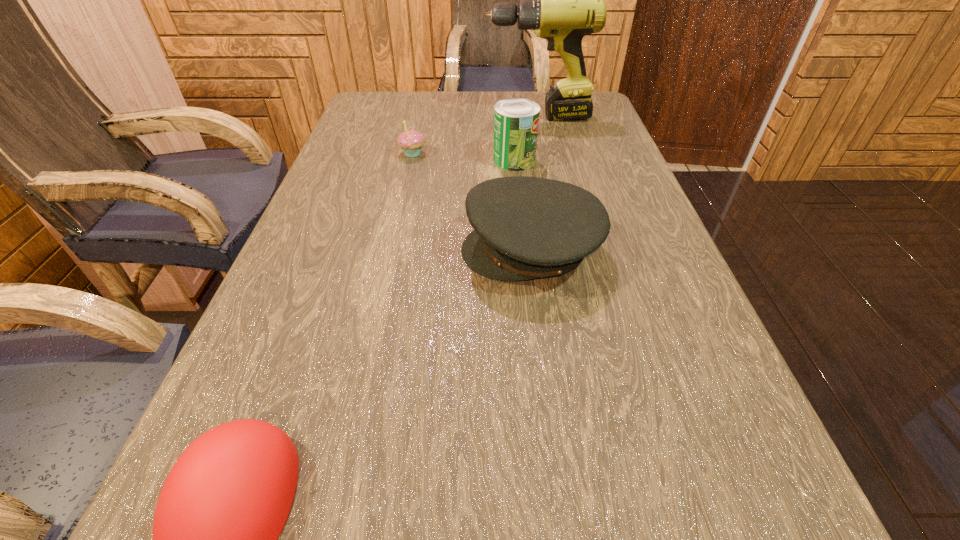
The width and height of the screenshot is (960, 540). In order to click on vacant space situated on the front-facing side of the beret in this screenshot , I will do `click(350, 250)`.

The height and width of the screenshot is (540, 960). Find the location of `free region located 0.240m on the front-facing side of the beret`. free region located 0.240m on the front-facing side of the beret is located at coordinates (340, 250).

Locate an element on the screen. Image resolution: width=960 pixels, height=540 pixels. vacant area located 0.180m on the right of the cupcake is located at coordinates (495, 154).

This screenshot has height=540, width=960. In order to click on object at the far edge in this screenshot , I will do `click(561, 0)`.

Image resolution: width=960 pixels, height=540 pixels. I want to click on drill present at the right edge, so [561, 0].

The image size is (960, 540). What are the coordinates of `beret that is at the right edge` in the screenshot? It's located at (x=525, y=228).

This screenshot has width=960, height=540. What are the coordinates of `object that is positioned at the far right corner` in the screenshot? It's located at (561, 0).

Where is `vacant point at the far edge`? vacant point at the far edge is located at coordinates (425, 113).

You are a GUI agent. You are given a task and a screenshot of the screen. Output one action in this format:
    pyautogui.click(x=<x>, y=<y>)
    Task: Click on the blank area at the left edge
    The width and height of the screenshot is (960, 540).
    Given the screenshot: What is the action you would take?
    pyautogui.click(x=321, y=266)

You are a GUI agent. You are given a task and a screenshot of the screen. Output one action in this format:
    pyautogui.click(x=<x>, y=<y>)
    Task: Click on the vacant region at the right edge
    The width and height of the screenshot is (960, 540).
    Given the screenshot: What is the action you would take?
    pyautogui.click(x=668, y=403)